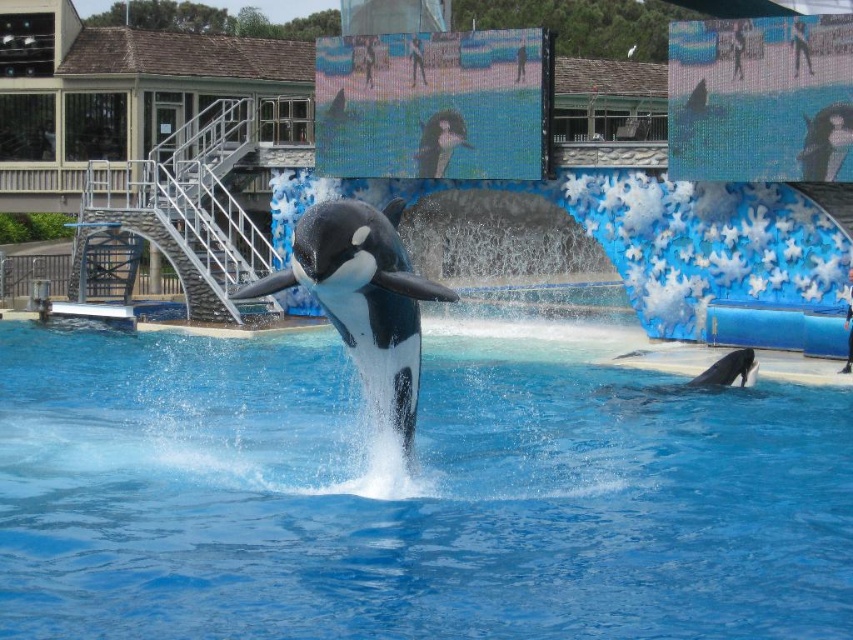
Who is lower down, blue smooth water at center or smooth gray dolphin at lower right?

blue smooth water at center is lower down.

Is blue smooth water at center shorter than smooth gray dolphin at lower right?

No.

This screenshot has width=853, height=640. I want to click on blue smooth water at center, so click(x=408, y=496).

This screenshot has width=853, height=640. Find the location of `blue smooth water at center`. blue smooth water at center is located at coordinates point(408,496).

Who is shorter, black smooth orca at center or smooth gray dolphin at lower right?

Standing shorter between the two is smooth gray dolphin at lower right.

Can you confirm if black smooth orca at center is smaller than smooth gray dolphin at lower right?

No, black smooth orca at center is not smaller than smooth gray dolphin at lower right.

Does point (403, 320) come in front of point (610, 387)?

Yes.

I want to click on black smooth orca at center, so click(x=363, y=298).

Is point (744, 500) more distant than point (331, 243)?

Yes, point (744, 500) is behind point (331, 243).

Locate an element on the screen. Image resolution: width=853 pixels, height=640 pixels. blue smooth water at center is located at coordinates (408, 496).

Is point (833, 440) positioned behind point (318, 218)?

Yes, point (833, 440) is farther from viewer.

The image size is (853, 640). In order to click on blue smooth water at center in this screenshot , I will do `click(408, 496)`.